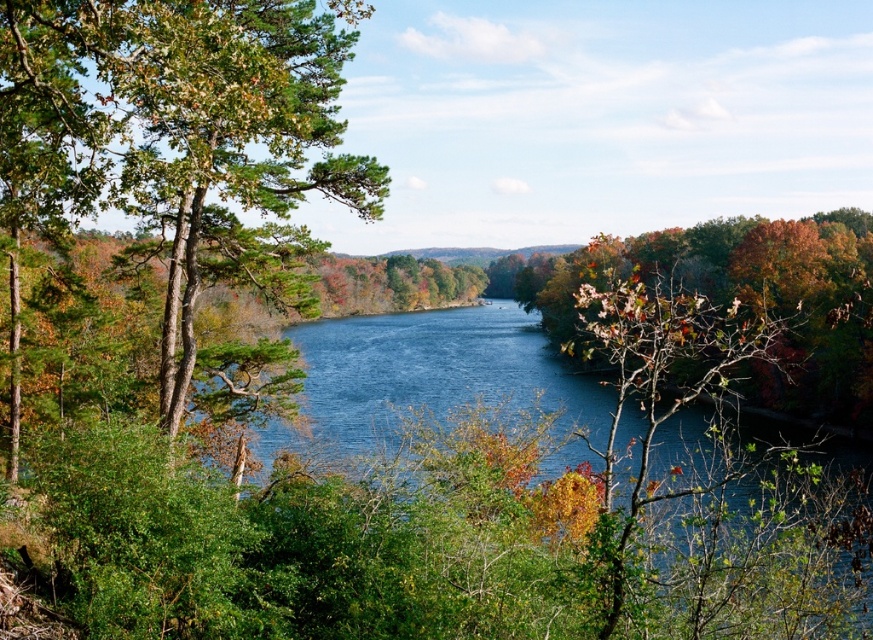
You are a bird flying over the serene natural landscape. You see the green matte tree at left and autumn leaves at right. Which object is positioned higher from the ground?

The green matte tree at left is positioned higher from the ground than autumn leaves at right because it is above them.

You are standing at the center of the image and want to walk to the green matte tree at left. In which direction should you head?

The green matte tree at left is located at point 0.220 on the x and 0.200 on the y axis, so you should head to the left and slightly forward to reach it.